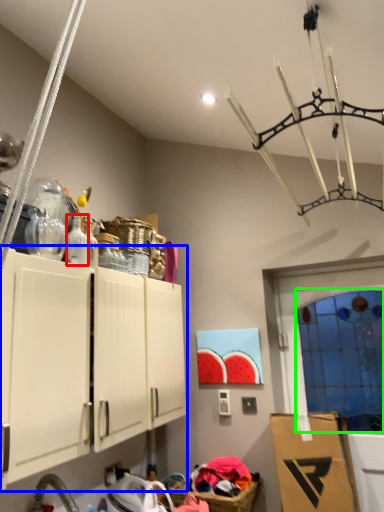
Question: Considering the real-world distances, which object is closest to bottle (highlighted by a red box)? cabinetry (highlighted by a blue box) or glass door (highlighted by a green box).

Choices:
 (A) cabinetry
 (B) glass door

Answer: (A)